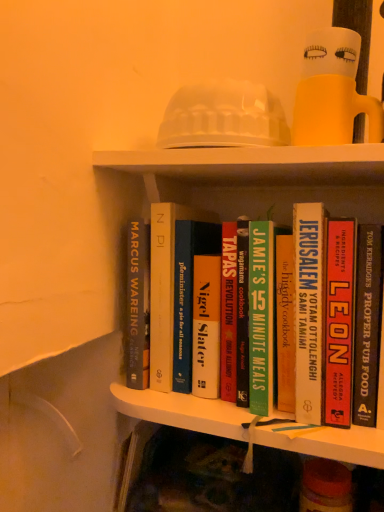
Question: Considering the positions of hardcover cookbook at center, marked as the 3th book in a left-to-right arrangement, and hardcover book at center, the first book when ordered from left to right, in the image, is hardcover cookbook at center, marked as the 3th book in a left-to-right arrangement, bigger or smaller than hardcover book at center, the first book when ordered from left to right,?

Choices:
 (A) small
 (B) big

Answer: (B)

Question: Is hardcover cookbook at center, arranged as the 3th book when viewed from the right, situated inside hardcover book at center, the first book when ordered from left to right, or outside?

Choices:
 (A) inside
 (B) outside

Answer: (B)

Question: Considering the real-world distances, which object is closest to the translucent plastic doll at upper center?

Choices:
 (A) hardcover book at center, which is counted as the 5th book, starting from the right
 (B) green matte book at center, acting as the fourth book starting from the right
 (C) hardcover book at center, which ranks as the 2th book in right-to-left order
 (D) hardcover cookbook at center, arranged as the 3th book when viewed from the right
 (E) black hardcover book at right, the 5th book from the left

Answer: (D)

Question: Which of these objects is positioned farthest from the hardcover book at center, which is counted as the 5th book, starting from the right?

Choices:
 (A) hardcover cookbook at center, arranged as the 3th book when viewed from the right
 (B) hardcover book at center, which ranks as the 2th book in right-to-left order
 (C) green matte book at center, the second book positioned from the left
 (D) translucent plastic doll at upper center
 (E) black hardcover book at right, the first book when ordered from right to left

Answer: (D)